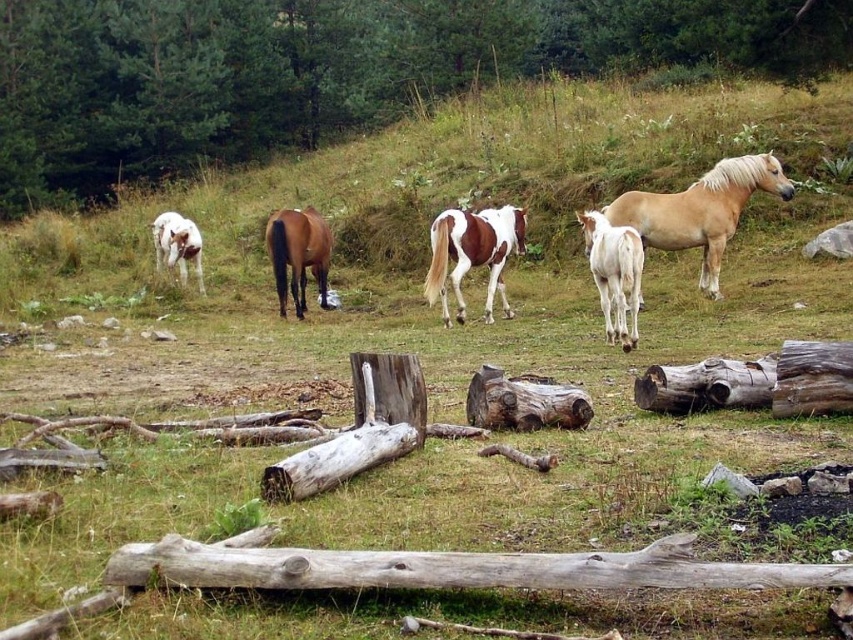
Question: Is gray rough log at lower center below weathered wood log at center?

Choices:
 (A) yes
 (B) no

Answer: (A)

Question: Which point is farther from the camera taking this photo?

Choices:
 (A) (167, 240)
 (B) (637, 228)
 (C) (474, 257)

Answer: (A)

Question: Which of the following is the farthest from the observer?

Choices:
 (A) white glossy pony at left
 (B) white glossy horse at center
 (C) brown wood log at center
 (D) brown glossy horse at center

Answer: (C)

Question: Which point is closer to the camera?

Choices:
 (A) gray rough log at lower center
 (B) weathered wood log at center
 (C) brown wood log at center
 (D) brown glossy horse at center

Answer: (A)

Question: Is weathered wood log at center thinner than white glossy pony at left?

Choices:
 (A) no
 (B) yes

Answer: (B)

Question: Observing the image, what is the correct spatial positioning of brown wood log at center in reference to white glossy pony at left?

Choices:
 (A) below
 (B) above

Answer: (B)